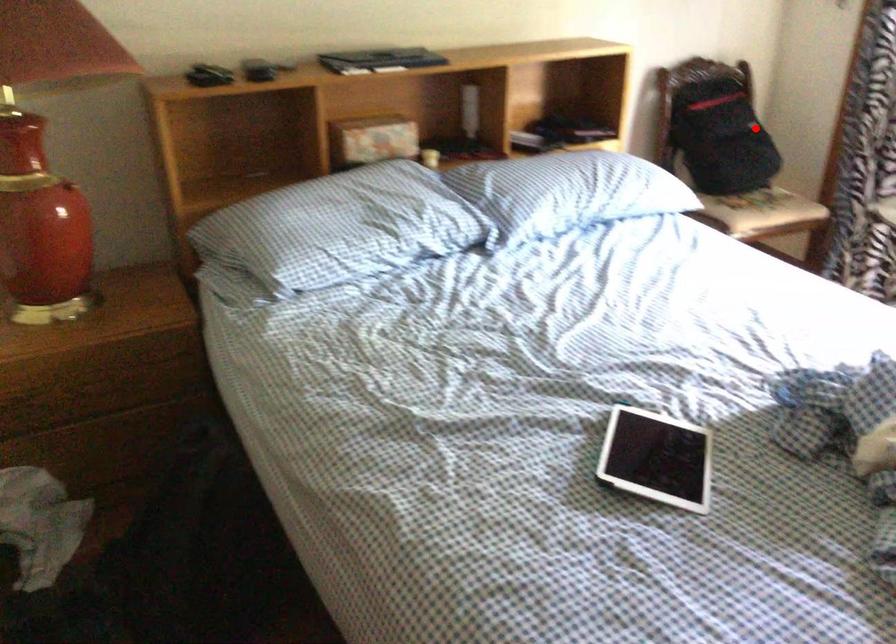
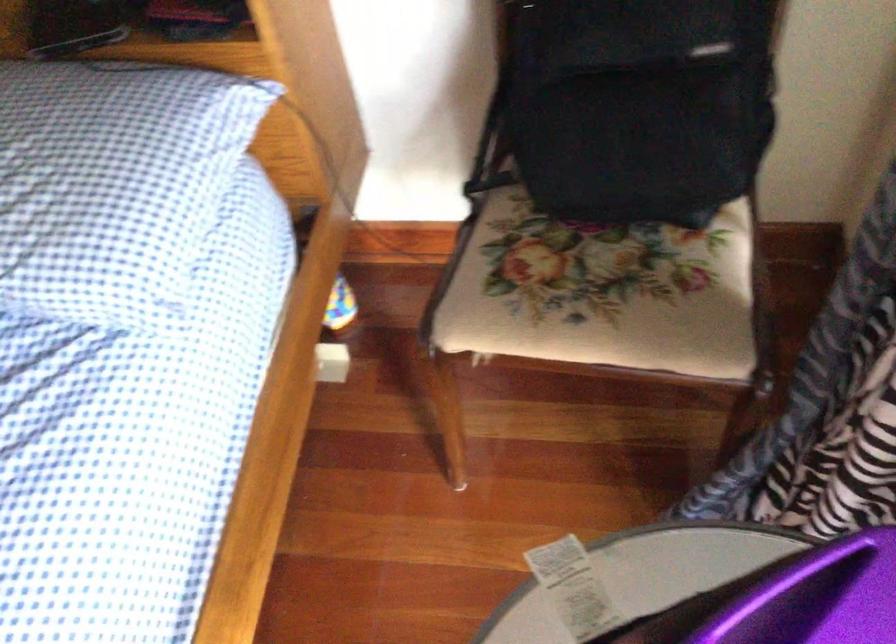
Question: I am providing you with two images of the same scene from different viewpoints. A red point is shown in image1. For the corresponding object point in image2, is it positioned nearer or farther from the camera?

Choices:
 (A) Nearer
 (B) Farther

Answer: (A)